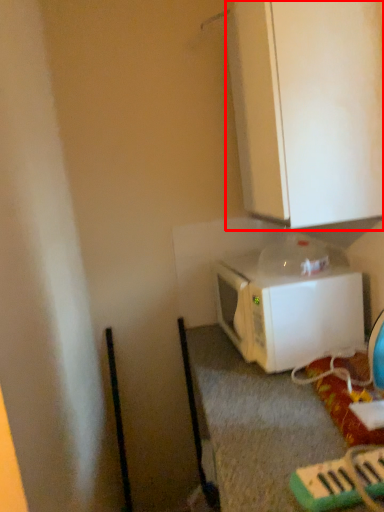
Question: From the image, what is the correct spatial relationship of cabinetry (annotated by the red box) in relation to microwave oven?

Choices:
 (A) left
 (B) right

Answer: (B)